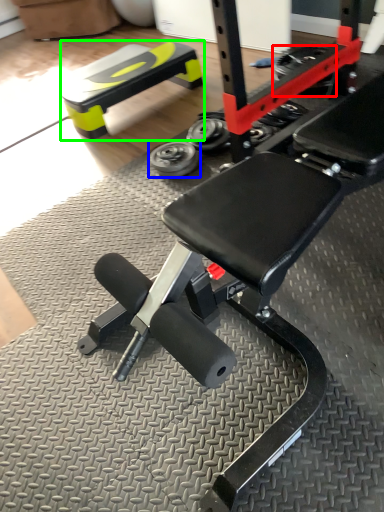
Question: Which object is positioned farthest from tire (highlighted by a red box)? Select from wheel (highlighted by a blue box) and bench (highlighted by a green box).

Choices:
 (A) wheel
 (B) bench

Answer: (A)